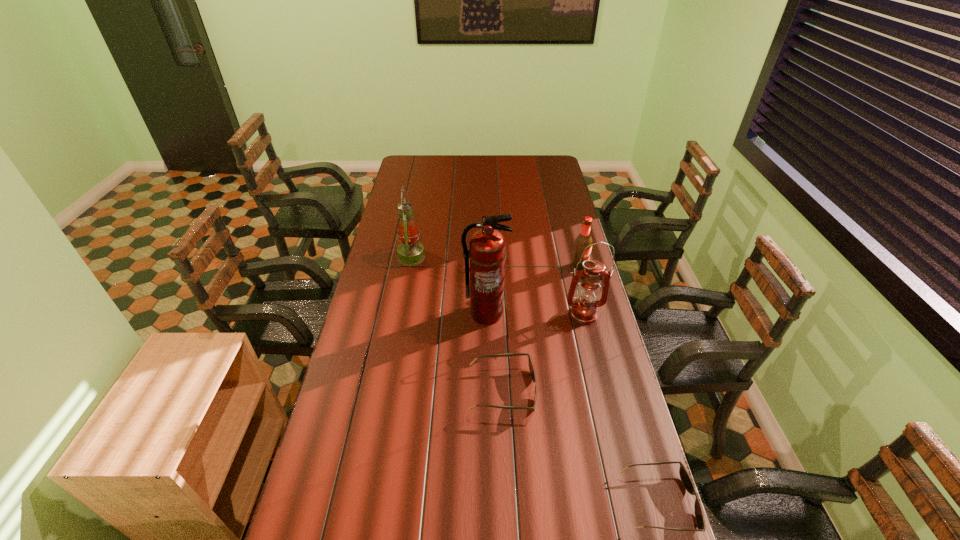
In order to click on free spot that satisfies the following two spatial constraints: 1. on the back side of the fourth tallest object; 2. on the left side of the right oil lamp in this screenshot , I will do `click(571, 267)`.

At what (x,y) coordinates should I click in order to perform the action: click on free space that satisfies the following two spatial constraints: 1. on the front side of the fourth tallest object; 2. on the left side of the farther oil lamp. Please return your answer as a coordinate pair (x, y). Looking at the image, I should click on (410, 267).